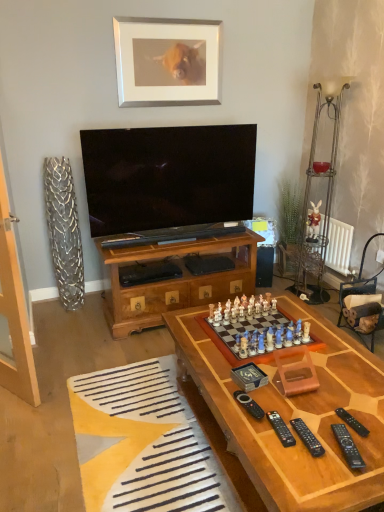
Where is `unoccupied region to the right of black plastic remote at lower right, the third remote in the left-to-right sequence`? The height and width of the screenshot is (512, 384). unoccupied region to the right of black plastic remote at lower right, the third remote in the left-to-right sequence is located at coordinates (347, 436).